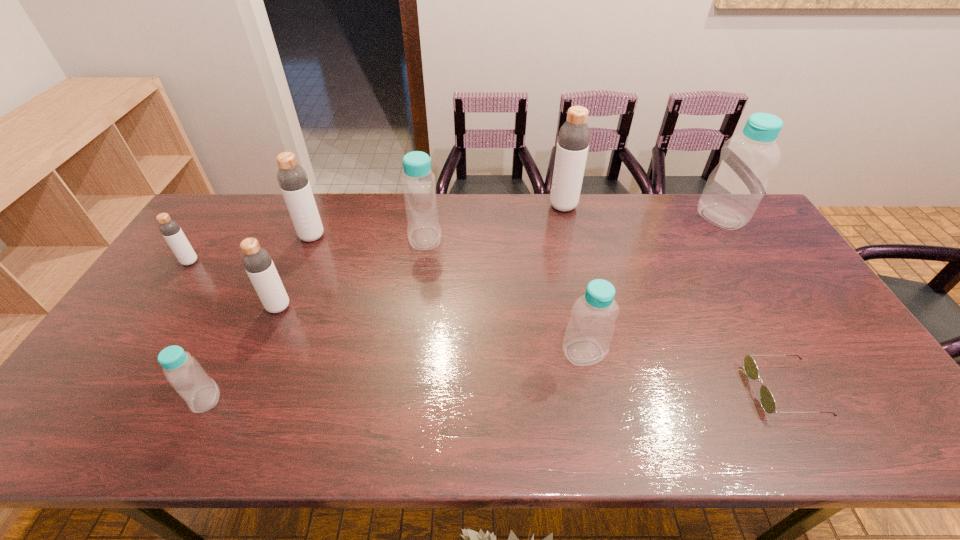
At what (x,y) coordinates should I click in order to perform the action: click on vacant area situated on the right of the second farthest gray bottle. Please return your answer as a coordinate pair (x, y). The width and height of the screenshot is (960, 540). Looking at the image, I should click on (355, 237).

Locate an element on the screen. This screenshot has height=540, width=960. vacant space located on the front of the nearest gray bottle is located at coordinates (229, 421).

At what (x,y) coordinates should I click in order to perform the action: click on free space located 0.350m on the right of the second smallest blue bottle. Please return your answer as a coordinate pair (x, y). Looking at the image, I should click on (743, 352).

Identify the location of blank space located 0.160m on the back of the fourth nearest bottle. (215, 225).

Image resolution: width=960 pixels, height=540 pixels. I want to click on free point located 0.240m on the right of the leftmost blue bottle, so click(323, 399).

Identify the location of vacant region located on the front-facing side of the sunglasses. pos(595,390).

Locate an element on the screen. The width and height of the screenshot is (960, 540). free point located on the front-facing side of the sunglasses is located at coordinates (640, 390).

This screenshot has width=960, height=540. Identify the location of free point located 0.050m on the front-facing side of the sunglasses. (732, 390).

Where is `bottle that is at the near edge`? The width and height of the screenshot is (960, 540). bottle that is at the near edge is located at coordinates (185, 374).

The width and height of the screenshot is (960, 540). I want to click on sunglasses that is at the near edge, so 767,401.